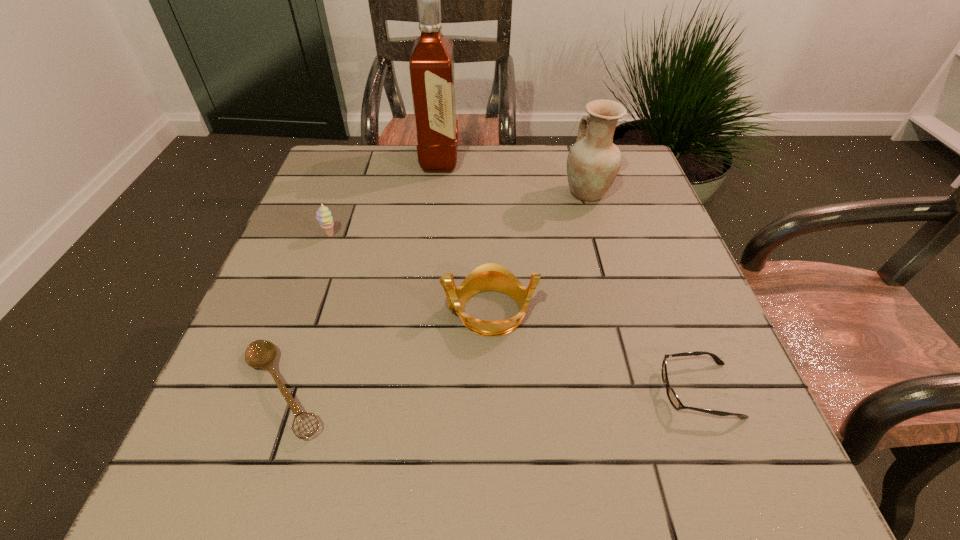
This screenshot has height=540, width=960. Identify the location of blank space at the left edge. (316, 198).

The height and width of the screenshot is (540, 960). In order to click on vacant area at the right edge of the desktop in this screenshot , I will do `click(644, 262)`.

In the image, there is a desktop. What are the coordinates of `free space at the far left corner` in the screenshot? It's located at (323, 167).

The image size is (960, 540). Identify the location of free space between the second tallest object and the shortest object. (435, 292).

Where is `free space between the farthest object and the fourth nearest object`? This screenshot has width=960, height=540. free space between the farthest object and the fourth nearest object is located at coordinates (385, 198).

The height and width of the screenshot is (540, 960). I want to click on free spot between the tallest object and the second tallest object, so click(x=514, y=177).

Where is `empty space between the sherbert and the fourth farthest object`? empty space between the sherbert and the fourth farthest object is located at coordinates (410, 273).

This screenshot has width=960, height=540. I want to click on free space between the tiara and the fifth nearest object, so (x=539, y=252).

The height and width of the screenshot is (540, 960). Find the location of `vacant area that lies between the liquor and the spectacles`. vacant area that lies between the liquor and the spectacles is located at coordinates (569, 275).

Image resolution: width=960 pixels, height=540 pixels. In order to click on free area in between the ladle and the liquor in this screenshot , I will do `click(362, 275)`.